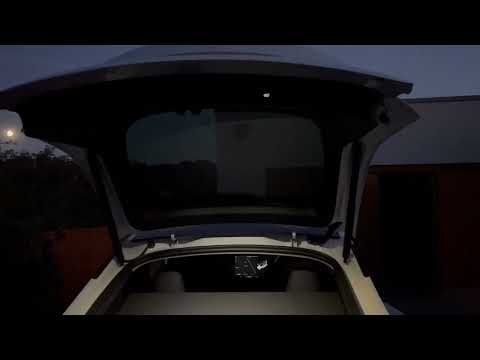
Image resolution: width=480 pixels, height=360 pixels. Identify the location of left seat. (170, 288).